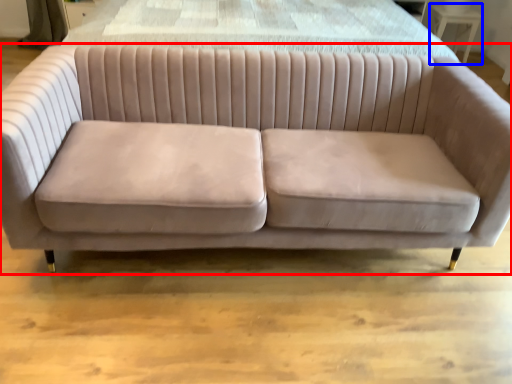
Question: Which object is closer to the camera taking this photo, studio couch (highlighted by a red box) or table (highlighted by a blue box)?

Choices:
 (A) studio couch
 (B) table

Answer: (A)